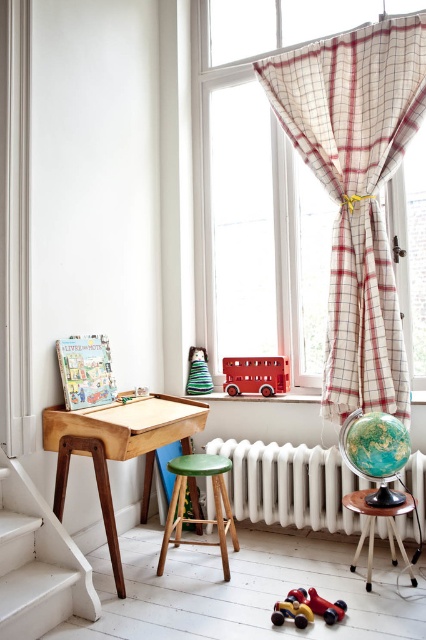
Can you confirm if green matte stool at center is positioned above green wood stool at lower center?

Indeed, green matte stool at center is positioned over green wood stool at lower center.

Which is in front, point (178, 486) or point (391, 529)?

Point (391, 529) is in front.

Find the location of `green matte stool at center`. green matte stool at center is located at coordinates (198, 518).

Does white wooden stair at lower left come in front of green striped fabric cone at center?

Yes, white wooden stair at lower left is closer to the viewer.

Measure the distance from white wooden stair at lower left to green striped fabric cone at center.

white wooden stair at lower left is 1.34 meters away from green striped fabric cone at center.

Which is in front, point (48, 515) or point (204, 381)?

Point (48, 515)

Where is `white wooden stair at lower left`? This screenshot has height=640, width=426. white wooden stair at lower left is located at coordinates (37, 563).

Does green wood stool at lower center have a greater height compared to green striped fabric cone at center?

Correct, green wood stool at lower center is much taller as green striped fabric cone at center.

Between green wood stool at lower center and green striped fabric cone at center, which one has more height?

Standing taller between the two is green wood stool at lower center.

Is point (368, 525) more distant than point (206, 378)?

No, it is in front of (206, 378).

Find the location of `green wood stool at lower center`. green wood stool at lower center is located at coordinates (374, 529).